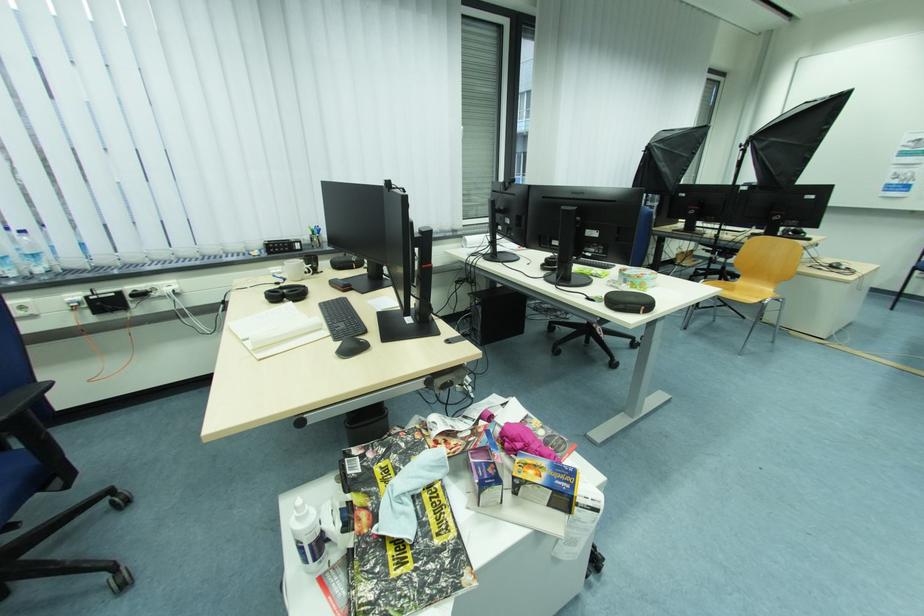
What are the coordinates of `white mug handle` in the screenshot? It's located at (310, 264).